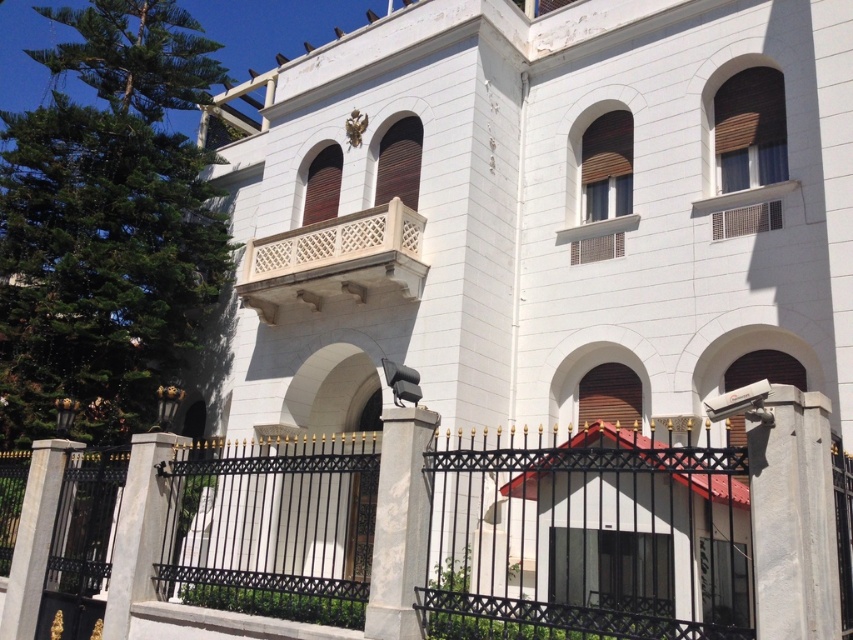
Is gray concrete security camera at right positioned before white stone pillar at lower left?

Yes, it is in front of white stone pillar at lower left.

Between gray concrete security camera at right and white stone pillar at lower left, which one appears on the left side from the viewer's perspective?

From the viewer's perspective, white stone pillar at lower left appears more on the left side.

This screenshot has height=640, width=853. I want to click on gray concrete security camera at right, so click(793, 516).

Can you confirm if black wrought iron fence at center is smaller than gray concrete pillar at lower left?

No, black wrought iron fence at center is not smaller than gray concrete pillar at lower left.

Identify the location of black wrought iron fence at center. (619, 524).

In order to click on black wrought iron fence at center in this screenshot , I will do `click(619, 524)`.

Can you confirm if gray concrete security camera at right is shorter than gray stone column at center?

In fact, gray concrete security camera at right may be taller than gray stone column at center.

Can you confirm if gray concrete security camera at right is positioned to the right of gray stone column at center?

Indeed, gray concrete security camera at right is positioned on the right side of gray stone column at center.

Which is behind, point (805, 620) or point (387, 465)?

The point (387, 465) is more distant.

Locate an element on the screen. gray concrete security camera at right is located at coordinates (793, 516).